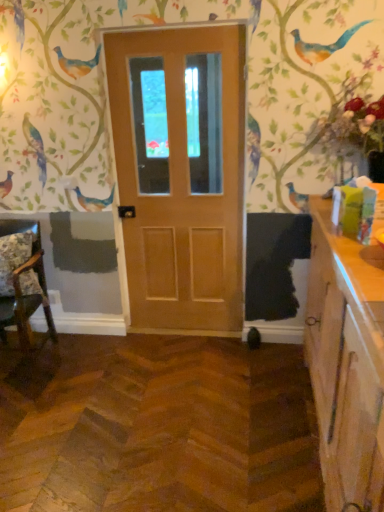
Question: Is fluffy floral pillow at left at the left side of wooden floral-patterned chair at left?

Choices:
 (A) yes
 (B) no

Answer: (B)

Question: Is fluffy floral pillow at left not within wooden floral-patterned chair at left?

Choices:
 (A) yes
 (B) no

Answer: (B)

Question: From a real-world perspective, is fluffy floral pillow at left located higher than wooden floral-patterned chair at left?

Choices:
 (A) yes
 (B) no

Answer: (A)

Question: From a real-world perspective, is fluffy floral pillow at left beneath wooden floral-patterned chair at left?

Choices:
 (A) yes
 (B) no

Answer: (B)

Question: Is the depth of fluffy floral pillow at left greater than that of wooden floral-patterned chair at left?

Choices:
 (A) no
 (B) yes

Answer: (B)

Question: From their relative heights in the image, would you say fluffy floral pillow at left is taller or shorter than wooden floral-patterned chair at left?

Choices:
 (A) short
 (B) tall

Answer: (A)

Question: From the image's perspective, is fluffy floral pillow at left positioned above or below wooden floral-patterned chair at left?

Choices:
 (A) above
 (B) below

Answer: (A)

Question: Is fluffy floral pillow at left in front of or behind wooden floral-patterned chair at left in the image?

Choices:
 (A) front
 (B) behind

Answer: (B)

Question: Visually, is fluffy floral pillow at left positioned to the left or to the right of wooden floral-patterned chair at left?

Choices:
 (A) left
 (B) right

Answer: (B)

Question: From the image's perspective, is wooden floral-patterned chair at left positioned above or below fluffy floral pillow at left?

Choices:
 (A) below
 (B) above

Answer: (A)

Question: Considering their positions, is wooden floral-patterned chair at left located in front of or behind fluffy floral pillow at left?

Choices:
 (A) front
 (B) behind

Answer: (A)

Question: Is wooden floral-patterned chair at left wider or thinner than fluffy floral pillow at left?

Choices:
 (A) thin
 (B) wide

Answer: (B)

Question: Does point (23, 346) appear closer or farther from the camera than point (6, 290)?

Choices:
 (A) closer
 (B) farther

Answer: (B)

Question: Would you say wooden cabinet at right is inside or outside matte wood door at center?

Choices:
 (A) inside
 (B) outside

Answer: (B)

Question: Based on their sizes in the image, would you say wooden cabinet at right is bigger or smaller than matte wood door at center?

Choices:
 (A) small
 (B) big

Answer: (B)